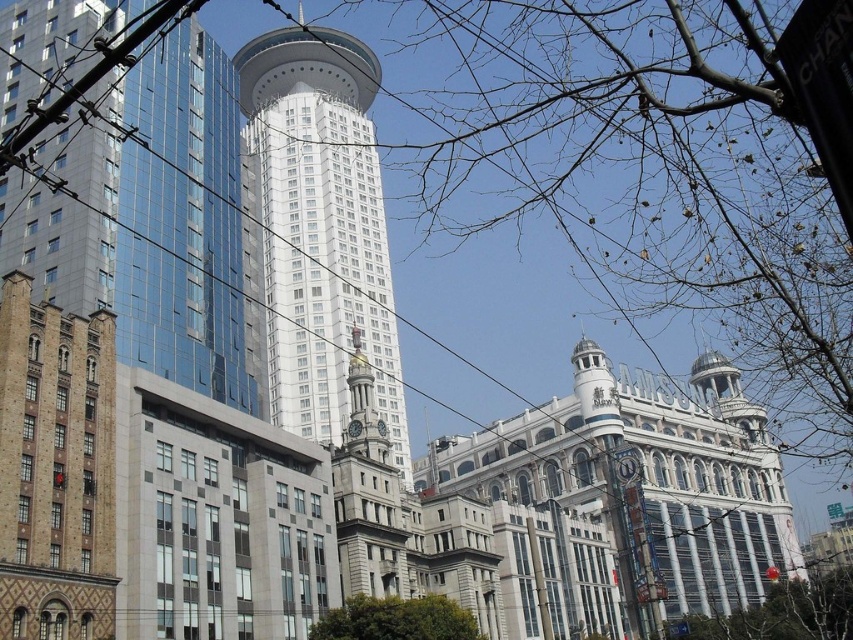
Question: Which point appears farthest from the camera in this image?

Choices:
 (A) (767, 596)
 (B) (288, 64)
 (C) (471, 636)
 (D) (370, 557)

Answer: (B)

Question: Which object appears closest to the camera in this image?

Choices:
 (A) bare branches at lower right
 (B) gold ornate clock tower at center
 (C) white glass tower at center

Answer: (B)

Question: Can you confirm if white glass tower at center is smaller than gold ornate clock tower at center?

Choices:
 (A) yes
 (B) no

Answer: (B)

Question: Does gold ornate clock tower at center have a lesser width compared to green leafy tree at lower center?

Choices:
 (A) yes
 (B) no

Answer: (A)

Question: Is bare branches at lower right positioned at the back of green leafy tree at lower center?

Choices:
 (A) yes
 (B) no

Answer: (A)

Question: Based on their relative distances, which object is farther from the white glass tower at center?

Choices:
 (A) gold ornate clock tower at center
 (B) green leafy tree at lower center
 (C) bare branches at lower right

Answer: (C)